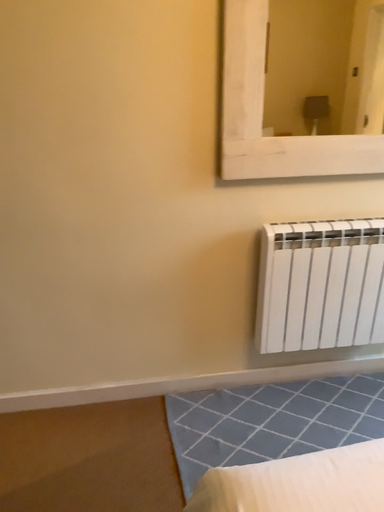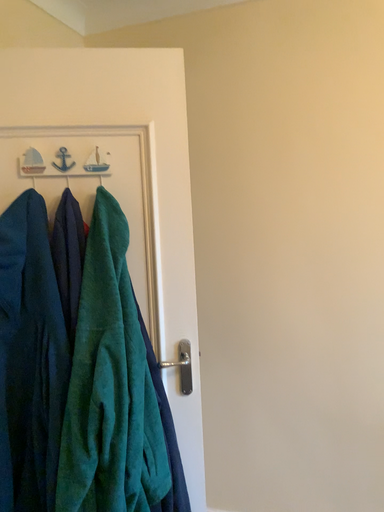
Question: Which way did the camera rotate in the video?

Choices:
 (A) rotated downward
 (B) rotated upward

Answer: (B)